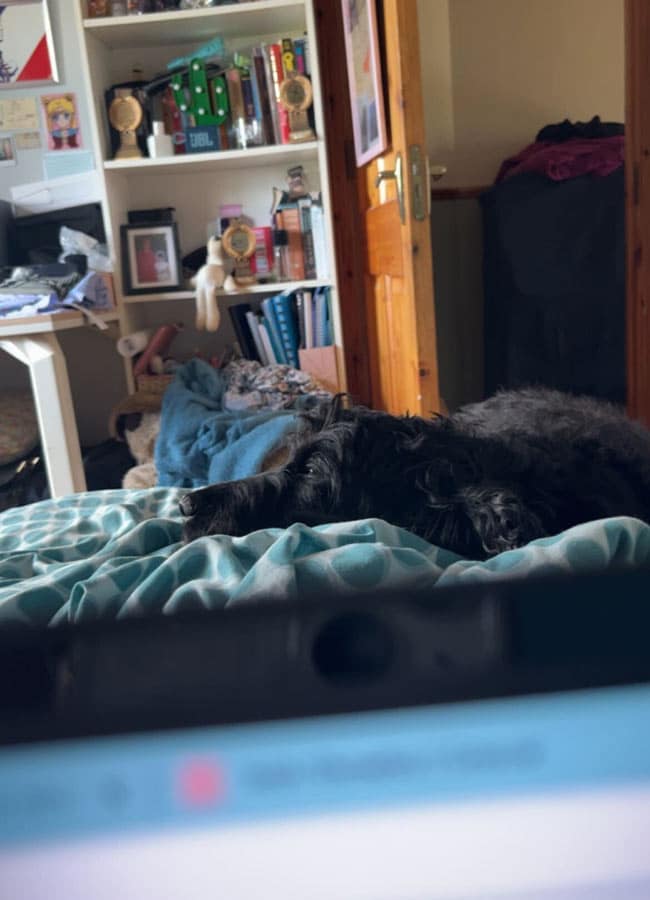
Where is `tiny light brown stuffed animal`? tiny light brown stuffed animal is located at coordinates [208, 275].